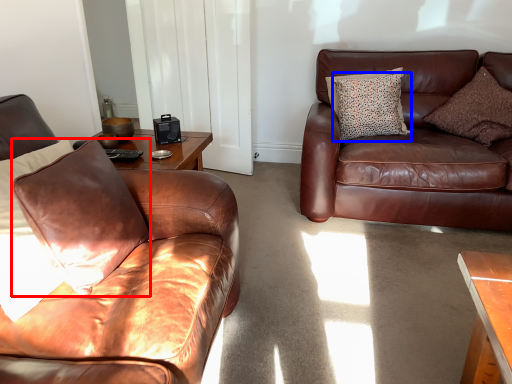
Question: Which object is closer to the camera taking this photo, pillow (highlighted by a red box) or pillow (highlighted by a blue box)?

Choices:
 (A) pillow
 (B) pillow

Answer: (A)